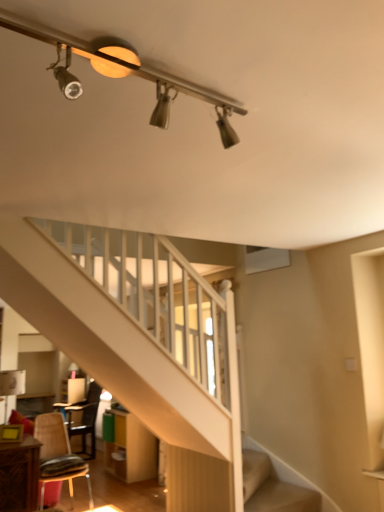
Question: Considering the positions of metallic brown chair at lower left, which is counted as the 2th chair, starting from the back, and wooden dresser at lower center in the image, is metallic brown chair at lower left, which is counted as the 2th chair, starting from the back, taller or shorter than wooden dresser at lower center?

Choices:
 (A) tall
 (B) short

Answer: (A)

Question: Considering the positions of metallic brown chair at lower left, which is counted as the 2th chair, starting from the back, and wooden dresser at lower center in the image, is metallic brown chair at lower left, which is counted as the 2th chair, starting from the back, wider or thinner than wooden dresser at lower center?

Choices:
 (A) wide
 (B) thin

Answer: (A)

Question: Which is nearer to the wooden dresser at lower center?

Choices:
 (A) metallic track lighting at upper center
 (B) wooden chair at lower left, the 1th chair when ordered from back to front
 (C) metallic brown chair at lower left, which is counted as the 2th chair, starting from the back

Answer: (B)

Question: Estimate the real-world distances between objects in this image. Which object is closer to the metallic track lighting at upper center?

Choices:
 (A) wooden chair at lower left, marked as the second chair in a front-to-back arrangement
 (B) wooden dresser at lower center
 (C) metallic brown chair at lower left, which appears as the 1th chair when viewed from the front

Answer: (C)